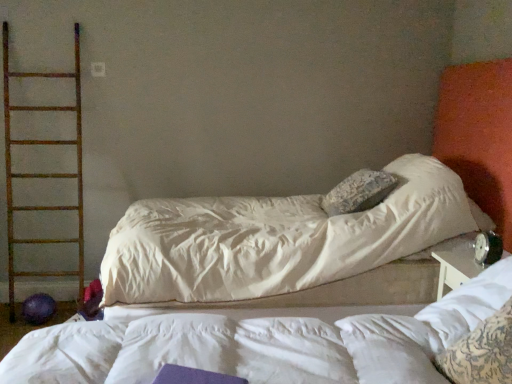
Locate an element on the screen. rusty metal ladder at left is located at coordinates (42, 173).

What is the approximate height of rusty metal ladder at left?

It is 5.89 feet.

The width and height of the screenshot is (512, 384). What do you see at coordinates (487, 248) in the screenshot? I see `black plastic alarm clock at right` at bounding box center [487, 248].

The height and width of the screenshot is (384, 512). In order to click on white textured pillow at right in this screenshot , I will do `click(469, 304)`.

Is black plastic alarm clock at right positioned beyond the bounds of rusty metal ladder at left?

Yes, black plastic alarm clock at right is outside of rusty metal ladder at left.

Based on the photo, is black plastic alarm clock at right further to the viewer compared to rusty metal ladder at left?

No, the depth of black plastic alarm clock at right is less than that of rusty metal ladder at left.

Based on the photo, considering the positions of objects black plastic alarm clock at right and rusty metal ladder at left in the image provided, who is more to the right, black plastic alarm clock at right or rusty metal ladder at left?

black plastic alarm clock at right.

How much distance is there between black plastic alarm clock at right and rusty metal ladder at left?

black plastic alarm clock at right and rusty metal ladder at left are 7.86 feet apart from each other.

Is point (10, 173) closer or farther from the camera than point (429, 321)?

Point (10, 173) appears to be farther away from the viewer than point (429, 321).

From a real-world perspective, is rusty metal ladder at left on top of white textured pillow at right?

Yes, from a real-world perspective, rusty metal ladder at left is over white textured pillow at right

Is white textured pillow at right at the back of rusty metal ladder at left?

No.

Consider the image. Between rusty metal ladder at left and white textured pillow at right, which one has smaller width?

white textured pillow at right is thinner.

Is white textured pillow at right facing towards black plastic alarm clock at right?

No, white textured pillow at right is not aimed at black plastic alarm clock at right.

Looking at this image, which object is more forward, white textured pillow at right or black plastic alarm clock at right?

white textured pillow at right is in front.

Find the location of a particular element. alarm clock positioned vertically above the white textured pillow at right (from a real-world perspective) is located at coordinates (487, 248).

From a real-world perspective, relative to rusty metal ladder at left, is white textured pillow at right vertically above or below?

In terms of real-world spatial position, white textured pillow at right is below rusty metal ladder at left.

Is white textured pillow at right facing towards rusty metal ladder at left?

No, white textured pillow at right is not oriented towards rusty metal ladder at left.

Can you confirm if white textured pillow at right is thinner than rusty metal ladder at left?

Yes, white textured pillow at right is thinner than rusty metal ladder at left.

What's the angular difference between white textured pillow at right and rusty metal ladder at left's facing directions?

The angular difference between white textured pillow at right and rusty metal ladder at left is 93.1 degrees.

What's the angular difference between black plastic alarm clock at right and white textured pillow at right's facing directions?

The facing directions of black plastic alarm clock at right and white textured pillow at right are 9.9 degrees apart.

Considering the points (481, 255) and (507, 257), which point is behind, point (481, 255) or point (507, 257)?

Positioned behind is point (481, 255).

Considering the relative sizes of black plastic alarm clock at right and white textured pillow at right in the image provided, is black plastic alarm clock at right wider than white textured pillow at right?

No.

Measure the distance between black plastic alarm clock at right and white textured pillow at right.

black plastic alarm clock at right and white textured pillow at right are 18.24 inches apart.

Considering their positions, is rusty metal ladder at left located in front of or behind black plastic alarm clock at right?

Clearly, rusty metal ladder at left is behind black plastic alarm clock at right.

Considering the positions of points (71, 111) and (481, 248), is point (71, 111) closer to camera compared to point (481, 248)?

No, (71, 111) is further to viewer.

Is rusty metal ladder at left positioned with its back to black plastic alarm clock at right?

rusty metal ladder at left is not turned away from black plastic alarm clock at right.

Can you confirm if rusty metal ladder at left is wider than black plastic alarm clock at right?

Yes, rusty metal ladder at left is wider than black plastic alarm clock at right.

I want to click on alarm clock below the rusty metal ladder at left (from the image's perspective), so click(x=487, y=248).

Locate an element on the screen. ladder that appears on the left of white textured pillow at right is located at coordinates (42, 173).

Estimate the real-world distances between objects in this image. Which object is further from black plastic alarm clock at right, white textured pillow at right or rusty metal ladder at left?

rusty metal ladder at left is further to black plastic alarm clock at right.

From the image, which object appears to be farther from rusty metal ladder at left, black plastic alarm clock at right or white textured pillow at right?

black plastic alarm clock at right.

Looking at the image, which one is located further to black plastic alarm clock at right, rusty metal ladder at left or white textured pillow at right?

The object further to black plastic alarm clock at right is rusty metal ladder at left.

Considering their positions, is rusty metal ladder at left positioned closer to white textured pillow at right than black plastic alarm clock at right?

The object closer to white textured pillow at right is black plastic alarm clock at right.

Which object lies further to the anchor point rusty metal ladder at left, white textured pillow at right or black plastic alarm clock at right?

Based on the image, black plastic alarm clock at right appears to be further to rusty metal ladder at left.

Looking at the image, which one is located further to white textured pillow at right, black plastic alarm clock at right or rusty metal ladder at left?

Among the two, rusty metal ladder at left is located further to white textured pillow at right.

The image size is (512, 384). I want to click on pillow between rusty metal ladder at left and black plastic alarm clock at right from left to right, so click(x=469, y=304).